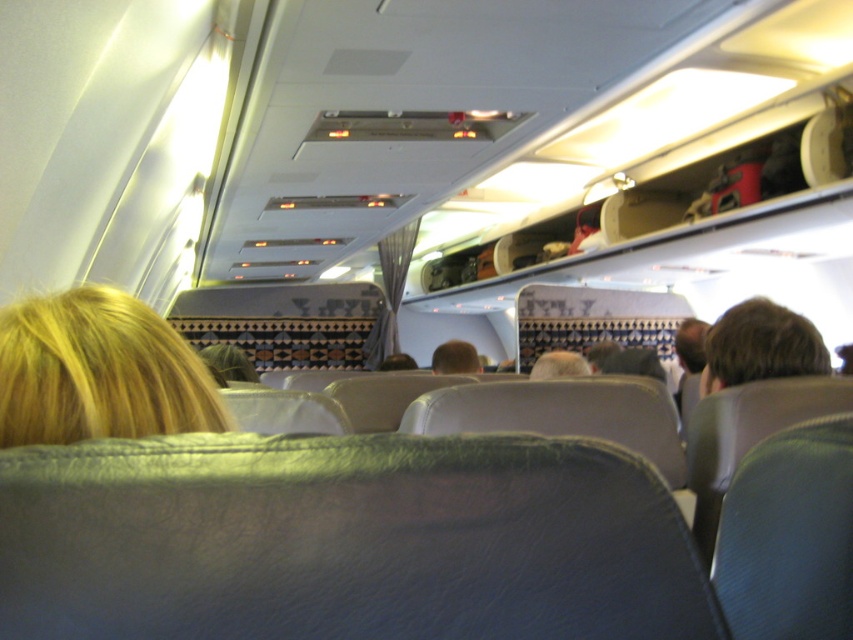
Question: Which point is farther from the camera taking this photo?

Choices:
 (A) (467, 355)
 (B) (171, 358)
 (C) (722, 380)

Answer: (A)

Question: Is brown hair at right thinner than blonde hair at center?

Choices:
 (A) no
 (B) yes

Answer: (B)

Question: Based on their relative distances, which object is farther from the brown hair at right?

Choices:
 (A) blonde hair at center
 (B) blonde hair at upper left

Answer: (A)

Question: Is brown hair at right above blonde hair at center?

Choices:
 (A) yes
 (B) no

Answer: (A)

Question: Which point is farther to the camera?

Choices:
 (A) blonde hair at upper left
 (B) brown hair at right
 (C) blonde hair at center

Answer: (C)

Question: Can you confirm if blonde hair at upper left is smaller than brown hair at right?

Choices:
 (A) no
 (B) yes

Answer: (B)